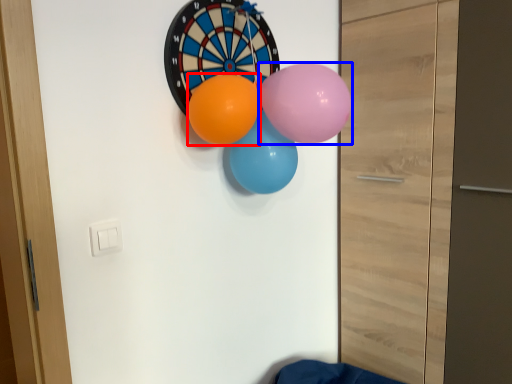
Question: Which object is closer to the camera taking this photo, balloon (highlighted by a red box) or balloon (highlighted by a blue box)?

Choices:
 (A) balloon
 (B) balloon

Answer: (B)